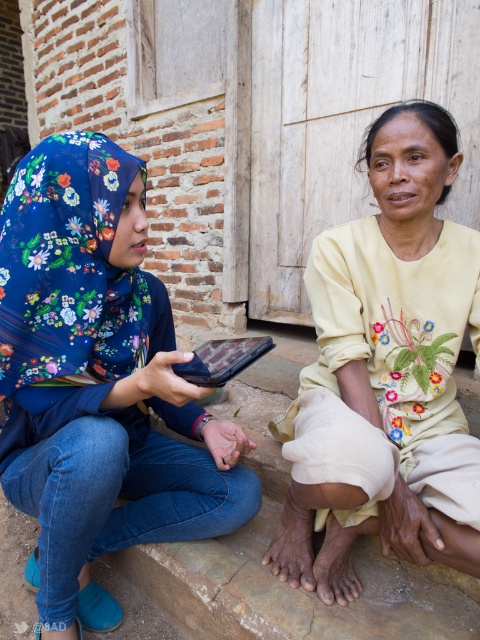
Question: Is floral fabric hijab at left positioned in front of matte black tablet at center?

Choices:
 (A) no
 (B) yes

Answer: (B)

Question: Which point is closer to the camera?

Choices:
 (A) floral fabric hijab at left
 (B) matte black tablet at center

Answer: (A)

Question: Which object is closer to the camera taking this photo?

Choices:
 (A) matte black tablet at center
 (B) floral fabric hijab at left

Answer: (B)

Question: Can you confirm if floral fabric hijab at left is wider than beige embroidered dress at center?

Choices:
 (A) yes
 (B) no

Answer: (A)

Question: Does floral fabric hijab at left lie in front of matte black tablet at center?

Choices:
 (A) yes
 (B) no

Answer: (A)

Question: Based on their relative distances, which object is farther from the beige embroidered dress at center?

Choices:
 (A) matte black tablet at center
 (B) floral fabric hijab at left

Answer: (B)